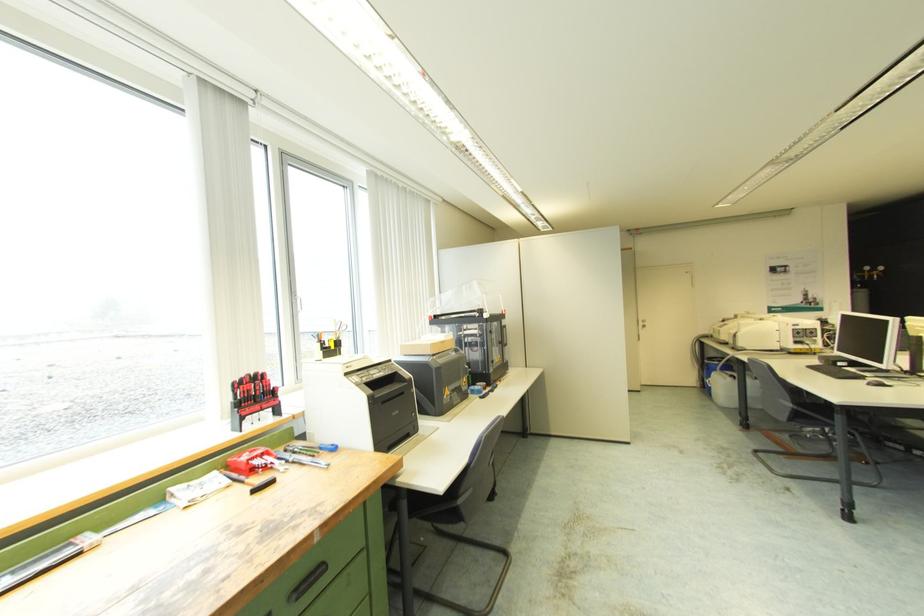
What do you see at coordinates (411, 90) in the screenshot?
I see `a white blind wand` at bounding box center [411, 90].